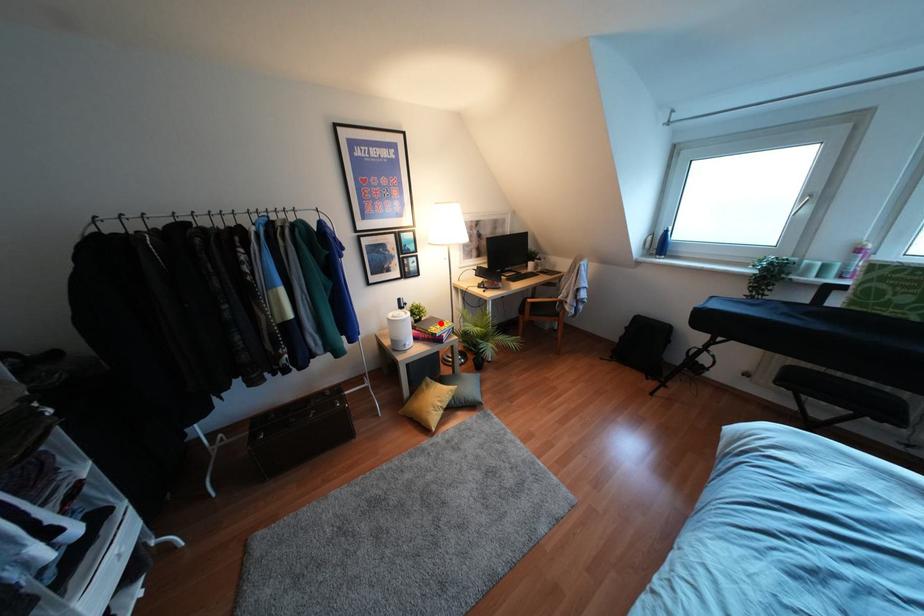
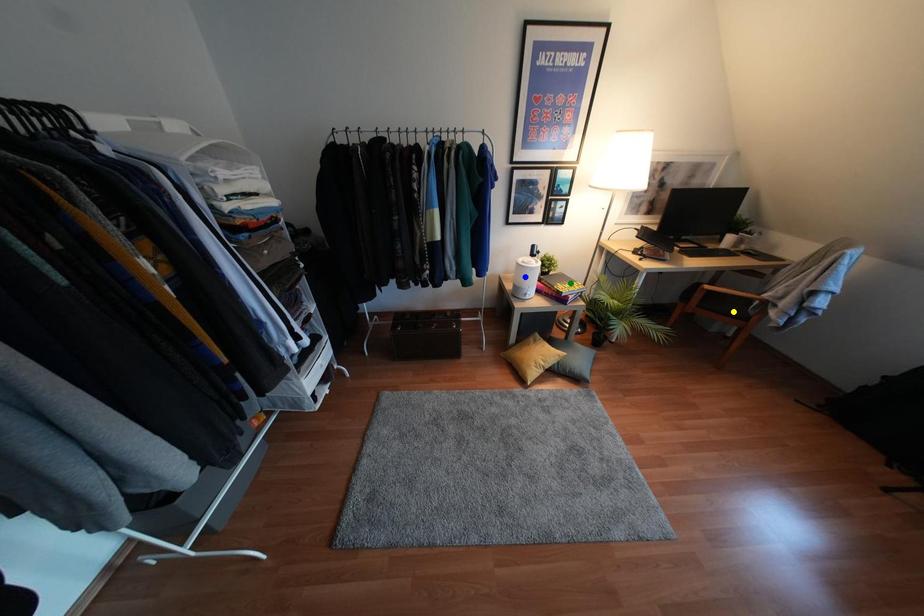
Question: I am providing you with two images of the same scene from different viewpoints. A red point is marked on the first image. You are given multiple points on the second image. Which spot in image 2 lines up with the point in image 1?

Choices:
 (A) blue point
 (B) yellow point
 (C) green point

Answer: (C)